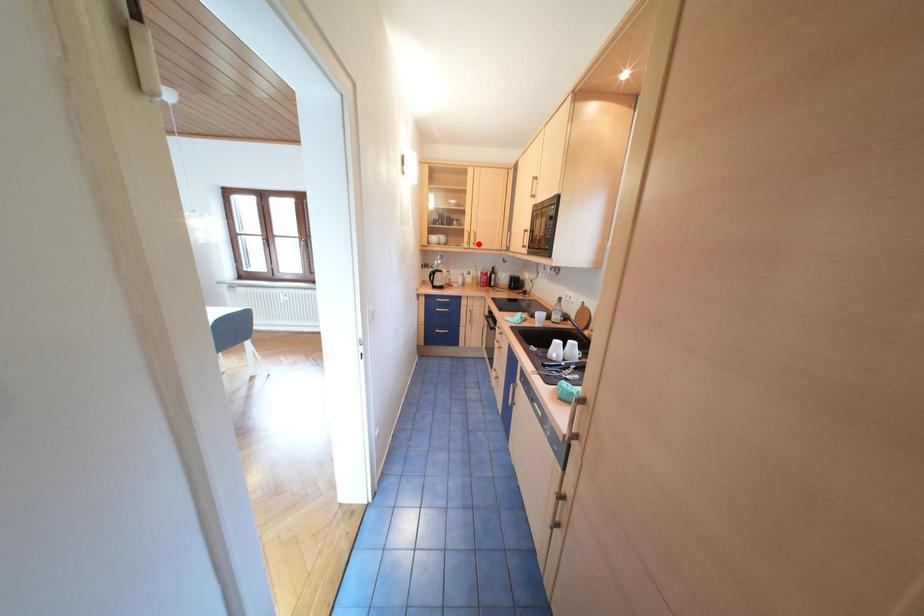
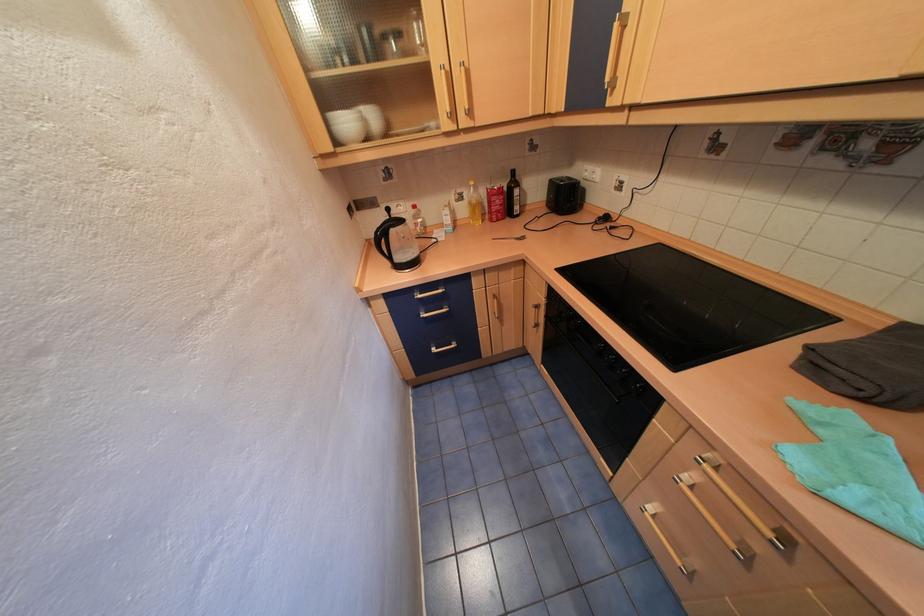
Locate, in the second image, the point that corresponds to the highlighted location in the first image.

(464, 114)